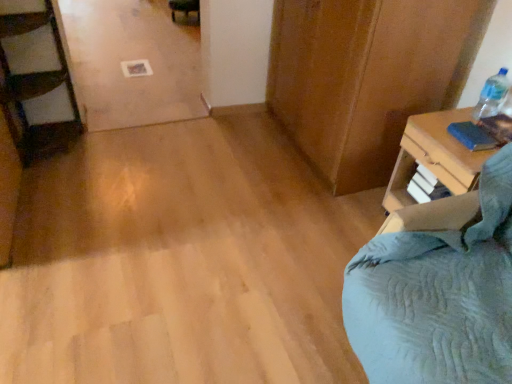
Locate an element on the screen. Image resolution: width=512 pixels, height=384 pixels. vacant space behind blue matte book at upper right is located at coordinates (454, 117).